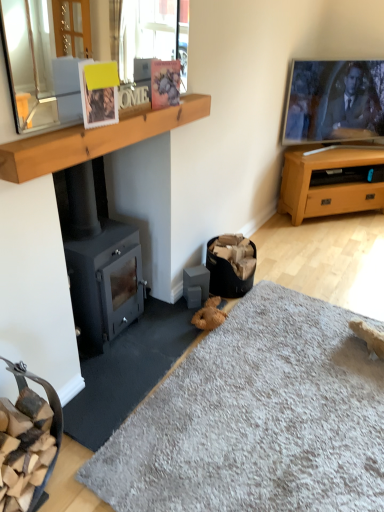
Where is `vacant space situated on the left part of white matte picture frame at upper center, which is the second picture frame in right-to-left order`? The image size is (384, 512). vacant space situated on the left part of white matte picture frame at upper center, which is the second picture frame in right-to-left order is located at coordinates (69, 126).